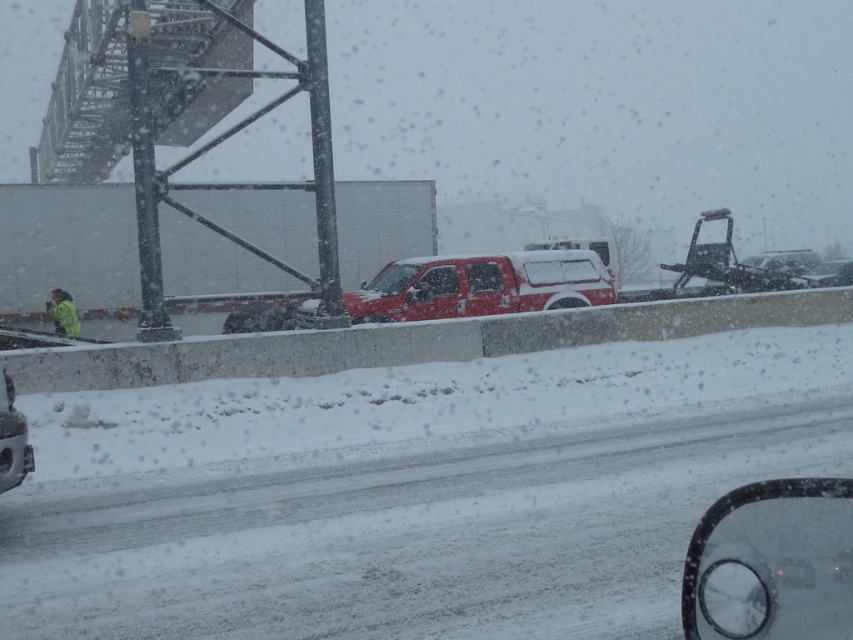
Question: Is matte red pickup truck at center thinner than shiny black car at lower left?

Choices:
 (A) yes
 (B) no

Answer: (B)

Question: Which point is farther from the camera taking this photo?

Choices:
 (A) (15, 465)
 (B) (430, 276)

Answer: (B)

Question: Can you confirm if matte red pickup truck at center is positioned to the right of shiny black car at lower left?

Choices:
 (A) yes
 (B) no

Answer: (A)

Question: Does matte red pickup truck at center appear on the right side of shiny black car at lower left?

Choices:
 (A) no
 (B) yes

Answer: (B)

Question: Which of the following is the closest to the observer?

Choices:
 (A) matte red pickup truck at center
 (B) shiny black car at lower left

Answer: (B)

Question: Which point appears closest to the camera in this image?

Choices:
 (A) (3, 378)
 (B) (532, 284)

Answer: (A)